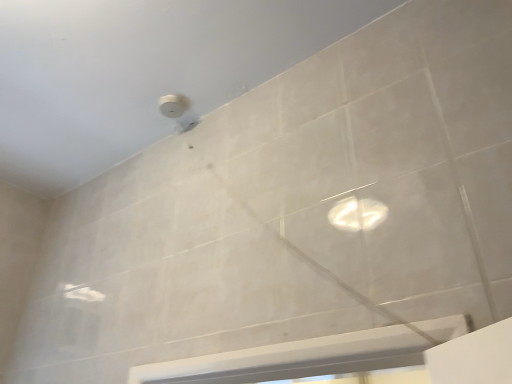
Question: Should I look upward or downward to see white plastic droplight at upper center?

Choices:
 (A) up
 (B) down

Answer: (A)